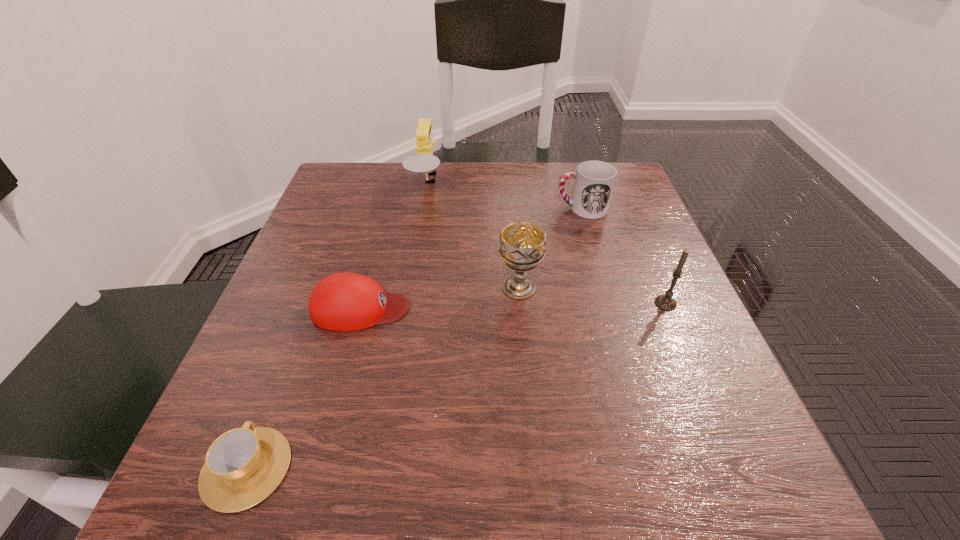
You are a GUI agent. You are given a task and a screenshot of the screen. Output one action in this format:
    pyautogui.click(x=<x>, y=<y>)
    Task: Click on the sponge
    The height and width of the screenshot is (540, 960).
    Given the screenshot: What is the action you would take?
    pyautogui.click(x=424, y=161)

At what (x,y) coordinates should I click in order to perform the action: click on the rightmost object. Please return your answer as a coordinate pair (x, y). The width and height of the screenshot is (960, 540). Looking at the image, I should click on [666, 302].

Image resolution: width=960 pixels, height=540 pixels. I want to click on chalice, so click(x=522, y=247).

The width and height of the screenshot is (960, 540). Identify the location of the taller cup. (594, 180).

At what (x,y) coordinates should I click in order to perform the action: click on the fourth tallest object. Please return your answer as a coordinate pair (x, y). This screenshot has width=960, height=540. Looking at the image, I should click on [x=594, y=180].

Where is `baseball cap`? baseball cap is located at coordinates (344, 301).

Where is `the shorter cup`? The width and height of the screenshot is (960, 540). the shorter cup is located at coordinates (243, 466).

The width and height of the screenshot is (960, 540). Identify the location of the shortest object. point(243,466).

The height and width of the screenshot is (540, 960). Find the location of `vacant space located on the front-facing side of the sponge`. vacant space located on the front-facing side of the sponge is located at coordinates (548, 184).

Image resolution: width=960 pixels, height=540 pixels. I want to click on free space located 0.210m on the front of the rightmost object, so click(x=714, y=418).